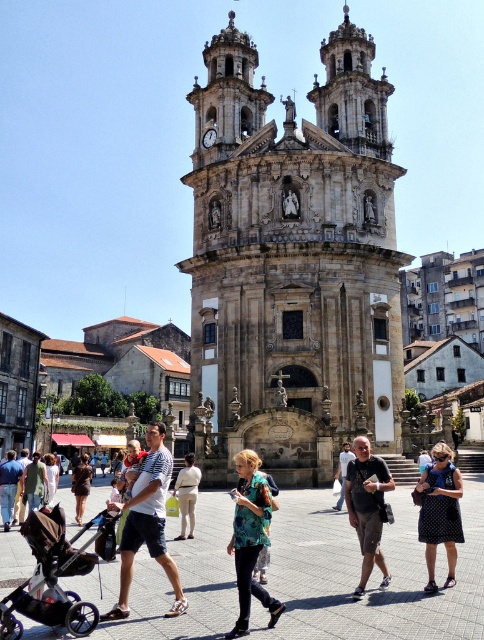
Question: Which of the following is the farthest from the observer?

Choices:
 (A) matte black shirt at center
 (B) printed fabric top at center

Answer: (A)

Question: Does brown stone tower at center come behind beige cotton shirt at center?

Choices:
 (A) no
 (B) yes

Answer: (B)

Question: Is black fabric stroller at lower left to the right of dark brown leather backpack at center from the viewer's perspective?

Choices:
 (A) no
 (B) yes

Answer: (A)

Question: Is dark brown leather backpack at center thinner than white cotton dress at center?

Choices:
 (A) yes
 (B) no

Answer: (A)

Question: Which object appears farthest from the camera in this image?

Choices:
 (A) brown stone tower at center
 (B) green cotton shirt at center

Answer: (A)

Question: Which object is closer to the camera taking this photo?

Choices:
 (A) brown stone tower at center
 (B) matte black shirt at center
 (C) brown leather jacket at center
 (D) dark brown leather backpack at center

Answer: (D)